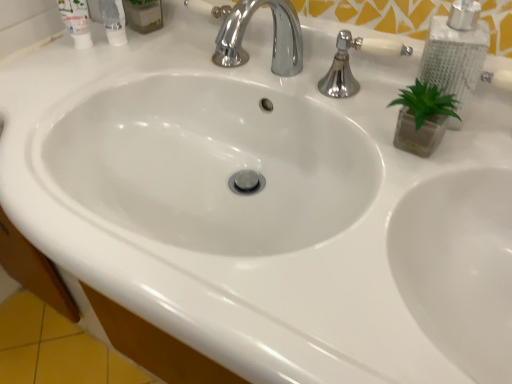
The height and width of the screenshot is (384, 512). Identify the location of free space in front of silver metallic soap dispenser at upper right. (428, 186).